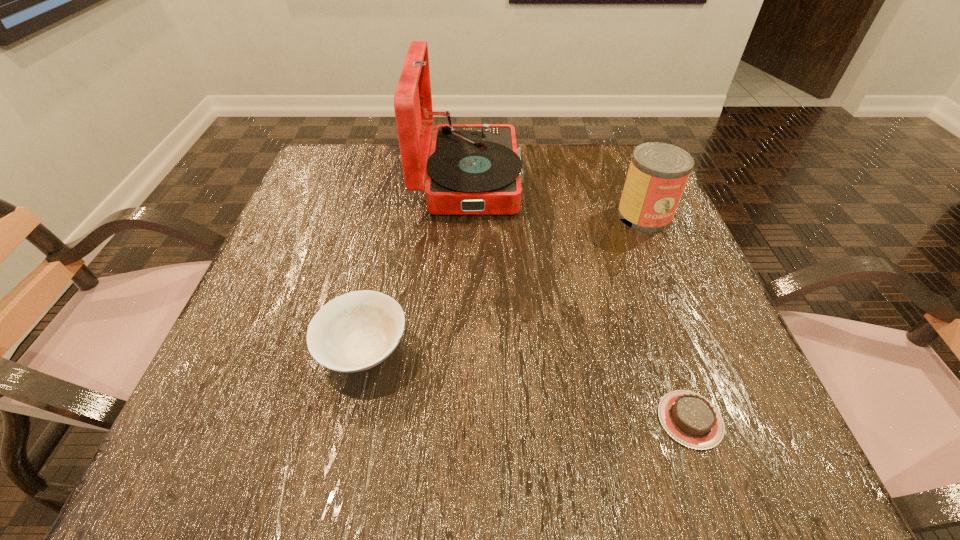
Image resolution: width=960 pixels, height=540 pixels. Find the location of `vacant space that is in between the third shortest object and the tallest object`. vacant space that is in between the third shortest object and the tallest object is located at coordinates (557, 197).

Where is `free spot between the chocolate cake and the tallest object`? free spot between the chocolate cake and the tallest object is located at coordinates (579, 299).

Select which object appears as the closest to the shortest object. Please provide its 2D coordinates. Your answer should be formatted as a tuple, i.e. [(x, y)], where the tuple contains the x and y coordinates of a point satisfying the conditions above.

[(658, 173)]

Find the location of `object that is the second closest to the third shortest object`. object that is the second closest to the third shortest object is located at coordinates (689, 418).

This screenshot has width=960, height=540. Identify the location of vacant space that satisfies the following two spatial constraints: 1. on the front side of the shortest object; 2. on the left side of the bowl. [x=348, y=420].

Image resolution: width=960 pixels, height=540 pixels. In order to click on free space in the image that satisfies the following two spatial constraints: 1. on the front-facing side of the tallest object; 2. on the left side of the second tallest object in this screenshot , I will do `click(468, 215)`.

The width and height of the screenshot is (960, 540). Identify the location of vacant space that satisfies the following two spatial constraints: 1. on the front-facing side of the can; 2. on the right side of the tallest object. (468, 215).

This screenshot has height=540, width=960. I want to click on vacant space that satisfies the following two spatial constraints: 1. on the front-facing side of the tallest object; 2. on the back side of the chocolate cake, so click(461, 420).

Where is `vacant region that satisfies the following two spatial constraints: 1. on the back side of the can; 2. on the front-facing side of the phonograph_record`? vacant region that satisfies the following two spatial constraints: 1. on the back side of the can; 2. on the front-facing side of the phonograph_record is located at coordinates (630, 179).

Identify the location of free space that satisfies the following two spatial constraints: 1. on the front-facing side of the phonograph_record; 2. on the back side of the shortest object. Image resolution: width=960 pixels, height=540 pixels. (461, 420).